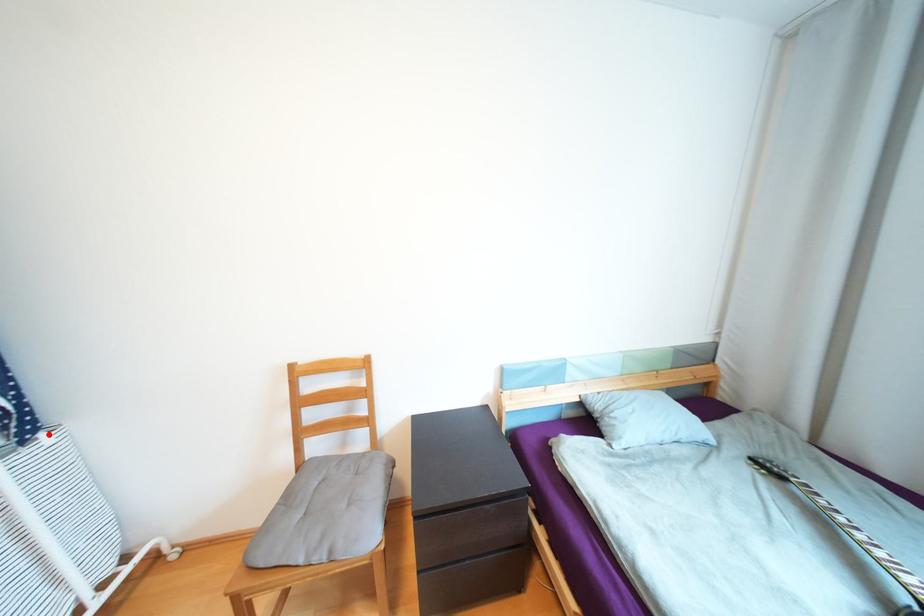
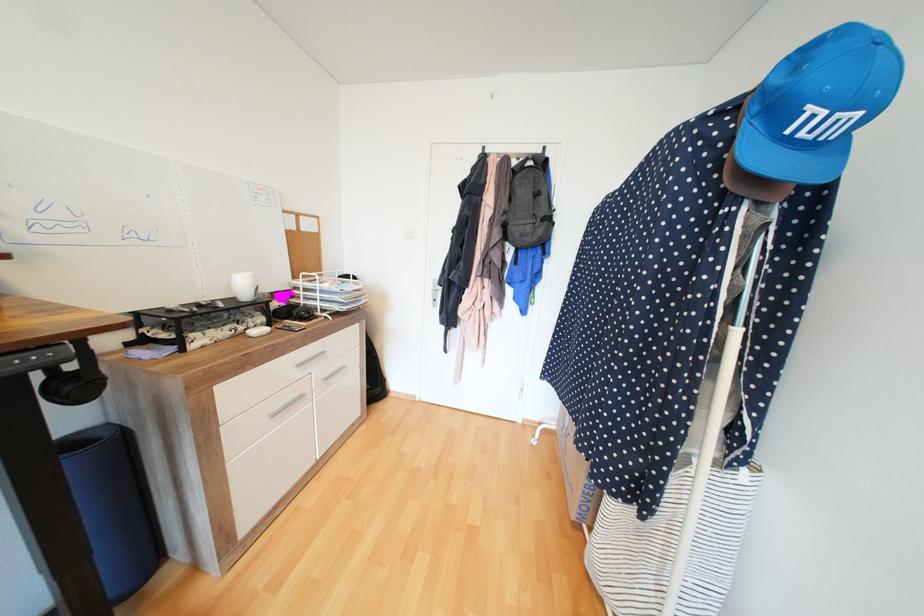
Question: A red point is marked in image1. In image2, is the corresponding 3D point closer to the camera or farther? Reply with the corresponding letter.

Choices:
 (A) The corresponding 3D point is closer.
 (B) The corresponding 3D point is farther.

Answer: (A)